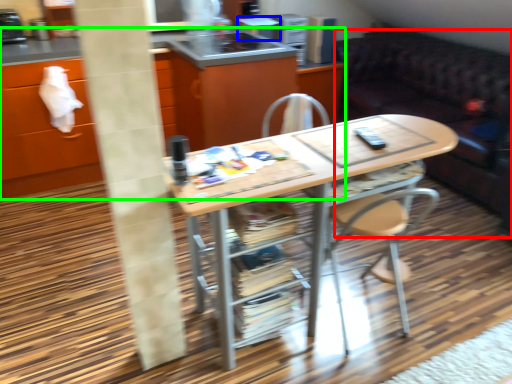
Question: Which is farther away from studio couch (highlighted by a red box)? appliance (highlighted by a blue box) or cabinetry (highlighted by a green box)?

Choices:
 (A) appliance
 (B) cabinetry

Answer: (B)